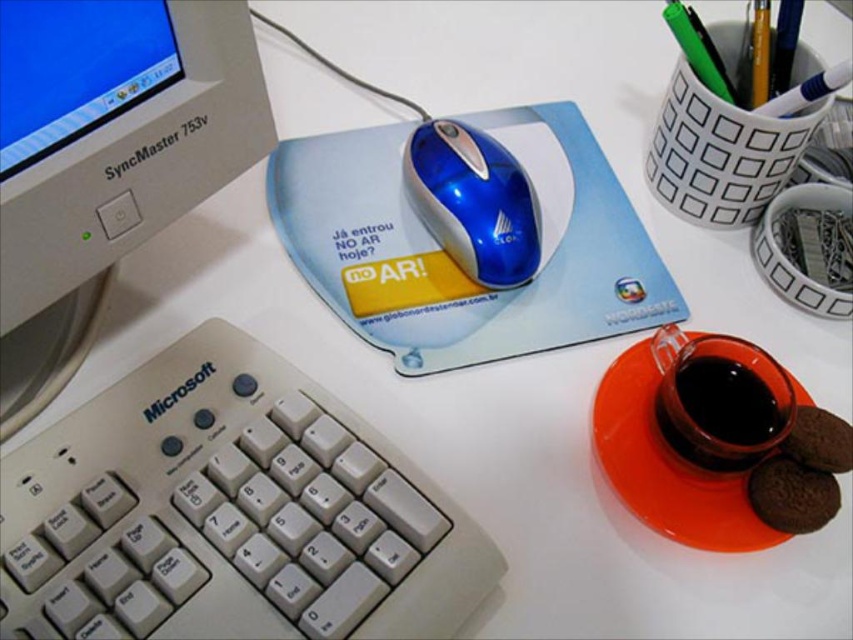
Based on the photo, can you confirm if white plastic keyboard at lower left is positioned to the right of blue glossy mouse at center?

In fact, white plastic keyboard at lower left is to the left of blue glossy mouse at center.

Does white plastic keyboard at lower left have a greater height compared to blue glossy mouse at center?

Indeed, white plastic keyboard at lower left has a greater height compared to blue glossy mouse at center.

Where is `white plastic keyboard at lower left`? Image resolution: width=853 pixels, height=640 pixels. white plastic keyboard at lower left is located at coordinates (229, 513).

Is matte plastic monitor at upper left closer to the viewer compared to translucent glass mug at lower right?

Yes, it is.

Is matte plastic monitor at upper left to the right of translucent glass mug at lower right from the viewer's perspective?

No, matte plastic monitor at upper left is not to the right of translucent glass mug at lower right.

Which is behind, point (115, 88) or point (682, 394)?

Positioned behind is point (682, 394).

I want to click on matte plastic monitor at upper left, so click(x=74, y=68).

Which is more to the right, white plastic monitor at upper left or black glossy cup at right?

Positioned to the right is black glossy cup at right.

This screenshot has height=640, width=853. I want to click on white plastic monitor at upper left, so click(106, 157).

This screenshot has width=853, height=640. I want to click on white plastic monitor at upper left, so point(106,157).